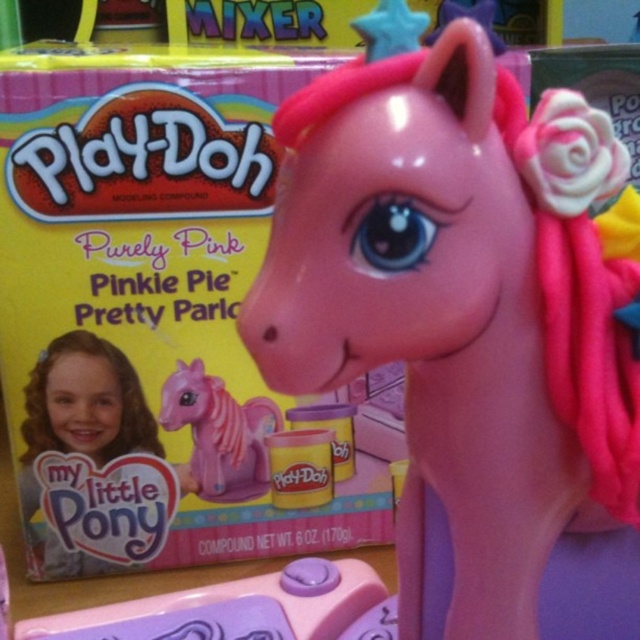
Question: Based on their relative distances, which object is nearer to the glossy plastic pony at center?

Choices:
 (A) matte purple plastic toy at center
 (B) pink matte plastic pony at center

Answer: (A)

Question: Considering the real-world distances, which object is farthest from the pink matte plastic pony at center?

Choices:
 (A) smooth skin girl at center
 (B) matte purple plastic toy at center

Answer: (B)

Question: In this image, where is smooth skin girl at center located relative to pink matte plastic pony at center?

Choices:
 (A) right
 (B) left

Answer: (B)

Question: Can you confirm if smooth skin girl at center is positioned to the left of pink matte plastic pony at center?

Choices:
 (A) yes
 (B) no

Answer: (A)

Question: Which of the following is the farthest from the observer?

Choices:
 (A) matte purple plastic toy at center
 (B) pink matte plastic pony at center
 (C) smooth skin girl at center

Answer: (B)

Question: Is matte purple plastic toy at center further to camera compared to pink matte plastic pony at center?

Choices:
 (A) yes
 (B) no

Answer: (B)